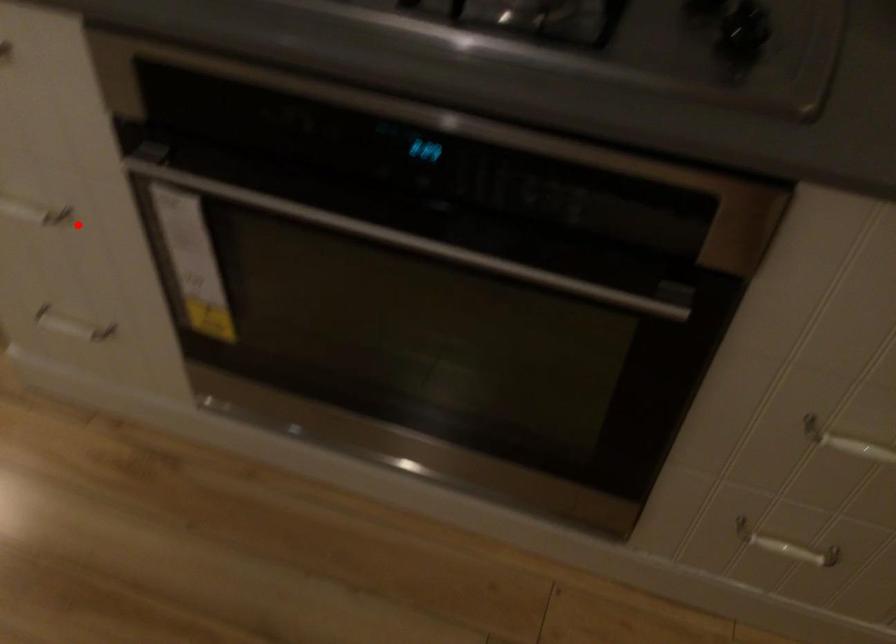
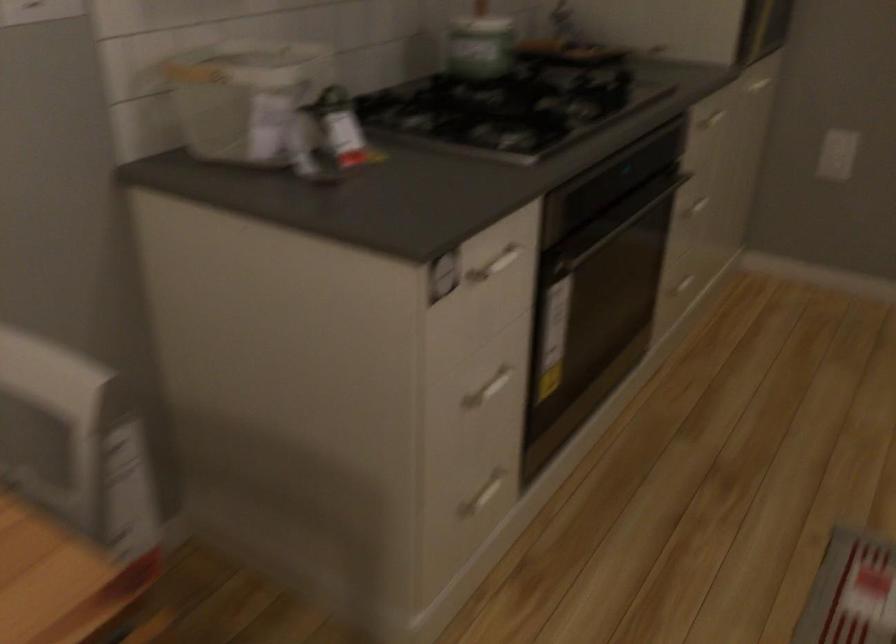
Question: I am providing you with two images of the same scene from different viewpoints. Image1 has a red point marked. In image2, the corresponding 3D location appears at what relative position? Reply with the corresponding letter.

Choices:
 (A) Closer
 (B) Farther

Answer: (B)